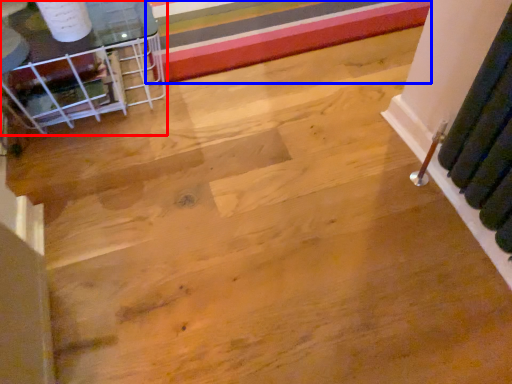
Question: Which object is further to the camera taking this photo, furniture (highlighted by a red box) or stripe (highlighted by a blue box)?

Choices:
 (A) furniture
 (B) stripe

Answer: (B)